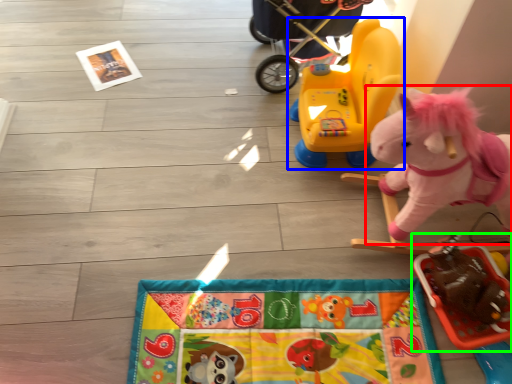
Question: Which object is the closest to the toy (highlighted by a red box)? Choose among these: toy (highlighted by a blue box) or toy (highlighted by a green box).

Choices:
 (A) toy
 (B) toy

Answer: (B)